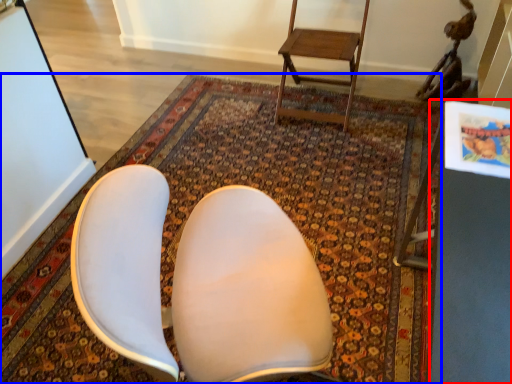
Question: Which object is further to the camera taking this photo, table (highlighted by a red box) or mat (highlighted by a blue box)?

Choices:
 (A) table
 (B) mat

Answer: (B)